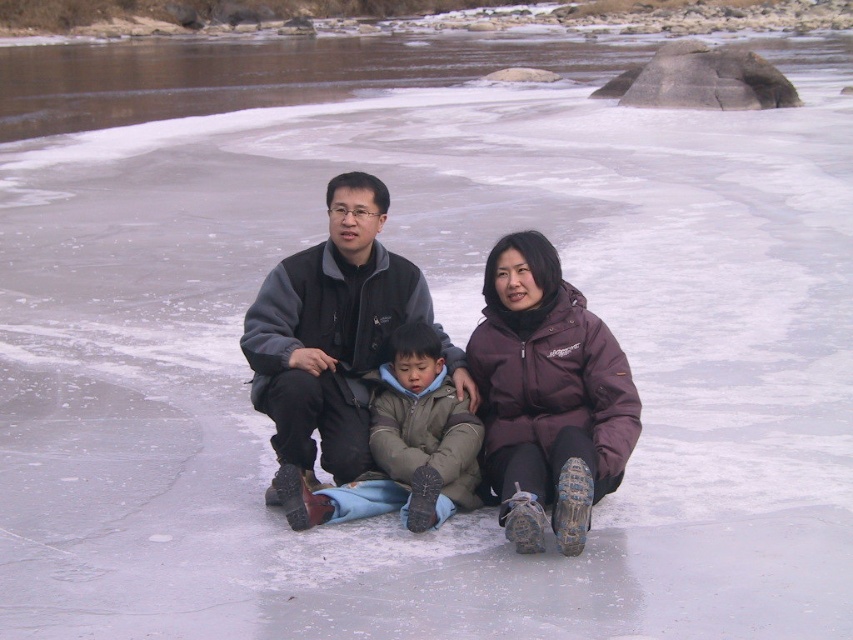
Question: Which object is positioned farthest from the dark brown jacket at center?

Choices:
 (A) purple softshell jacket at center
 (B) khaki fleece jacket at center

Answer: (B)

Question: Considering the real-world distances, which object is farthest from the purple softshell jacket at center?

Choices:
 (A) khaki fleece jacket at center
 (B) dark brown jacket at center

Answer: (A)

Question: Which point is closer to the camera taking this photo?

Choices:
 (A) (399, 368)
 (B) (508, 365)

Answer: (B)

Question: Does dark brown jacket at center have a lesser width compared to purple softshell jacket at center?

Choices:
 (A) yes
 (B) no

Answer: (B)

Question: Can you confirm if dark brown jacket at center is positioned below purple softshell jacket at center?

Choices:
 (A) yes
 (B) no

Answer: (B)

Question: Does dark brown jacket at center appear over khaki fleece jacket at center?

Choices:
 (A) yes
 (B) no

Answer: (A)